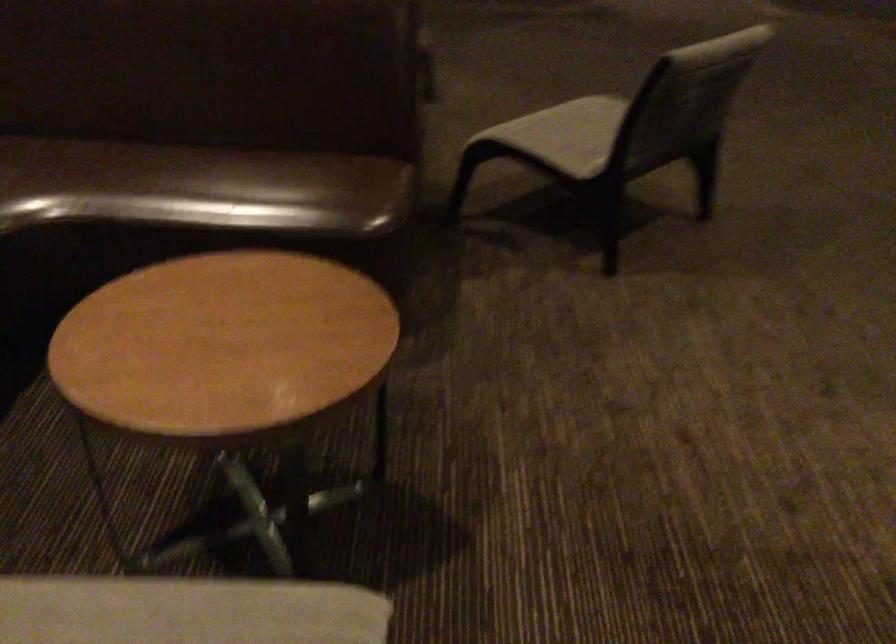
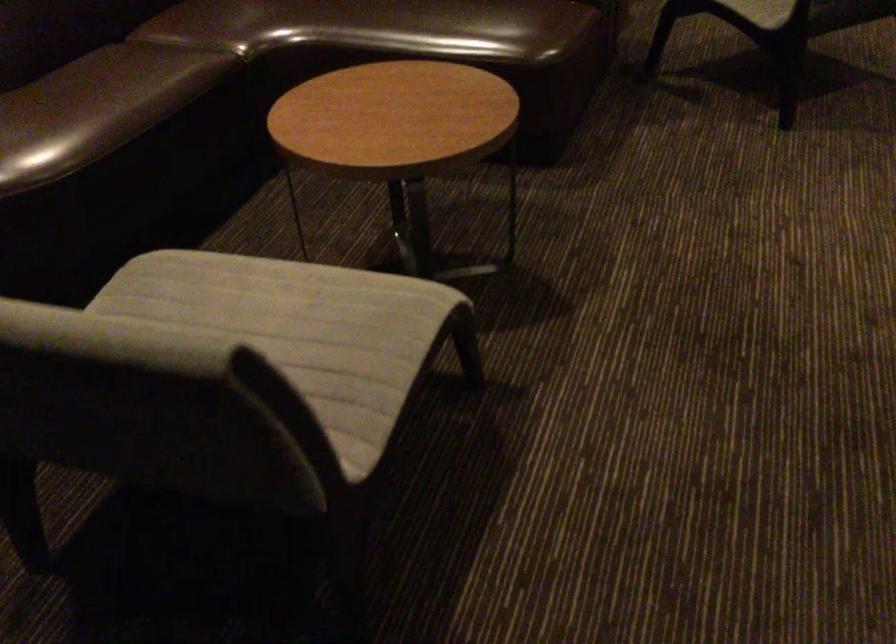
In a continuous first-person perspective shot, in which direction is the camera moving?

The movement direction of the cameraman is right, backward.